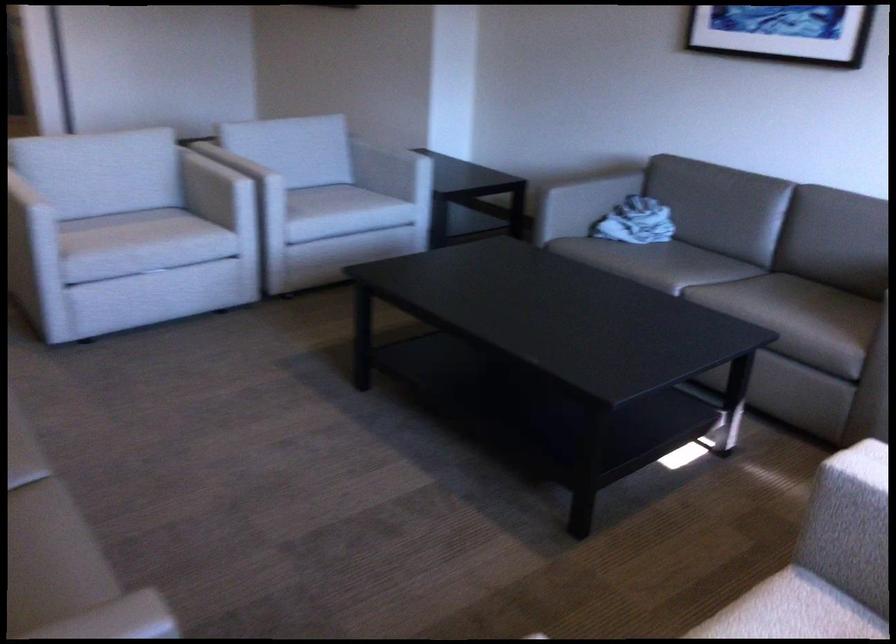
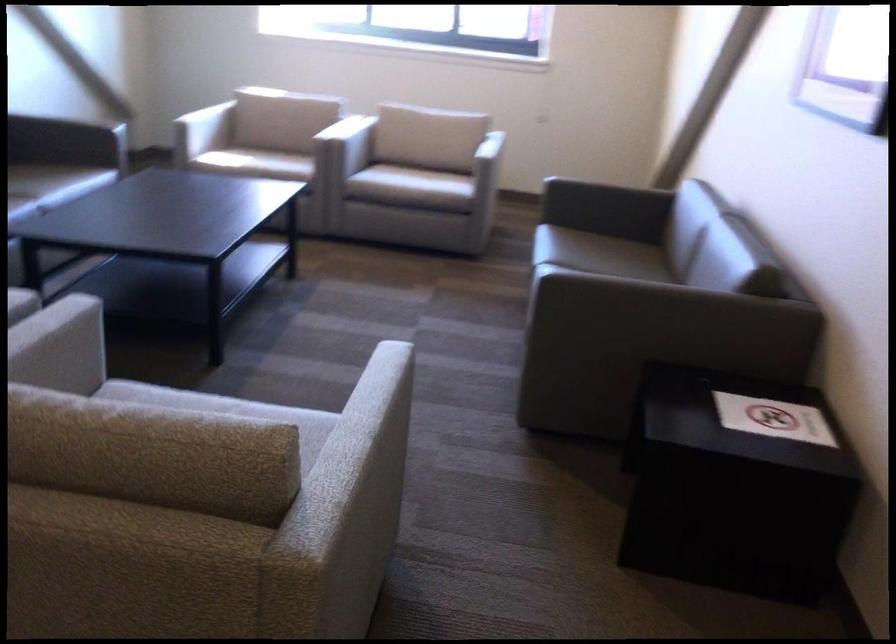
In the second image, find the point that corresponds to [254,412] in the first image.

(279, 406)